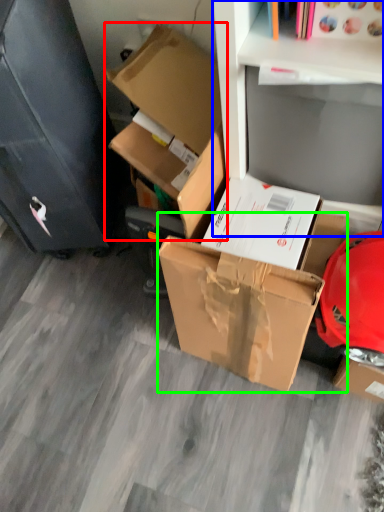
Question: Considering the real-world distances, which object is closest to box (highlighted by a red box)? shelf (highlighted by a blue box) or box (highlighted by a green box).

Choices:
 (A) shelf
 (B) box

Answer: (A)